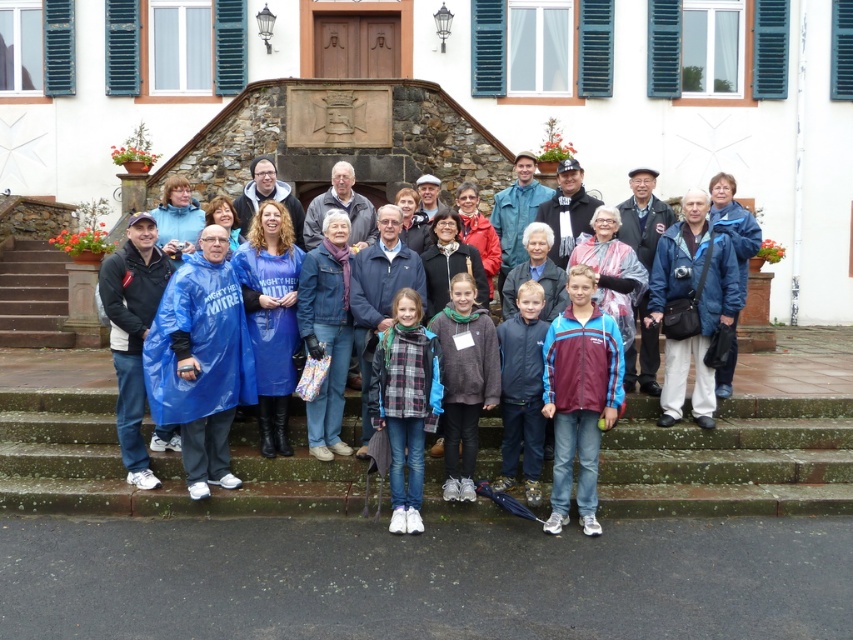
In the scene shown: Can you confirm if concrete stairs at center is positioned to the right of blue/white striped jacket at center?

Indeed, concrete stairs at center is positioned on the right side of blue/white striped jacket at center.

Is concrete stairs at center thinner than blue/white striped jacket at center?

Indeed, concrete stairs at center has a lesser width compared to blue/white striped jacket at center.

I want to click on concrete stairs at center, so click(x=730, y=460).

In order to click on concrete stairs at center in this screenshot , I will do `click(730, 460)`.

Who is positioned more to the right, concrete stairs at center or brown stone stairs at left?

concrete stairs at center

Which is above, concrete stairs at center or brown stone stairs at left?

brown stone stairs at left is above.

Which is in front, point (77, 502) or point (53, 264)?

Positioned in front is point (77, 502).

Where is `concrete stairs at center`? This screenshot has width=853, height=640. concrete stairs at center is located at coordinates (730, 460).

Who is more forward, (582, 268) or (537, 413)?

Point (582, 268)

Looking at this image, can you confirm if blue/white striped jacket at center is bigger than blue waterproof poncho at center?

Yes.

Is point (577, 493) positioned behind point (347, 467)?

No, it is in front of (347, 467).

Find the location of a particular element. blue/white striped jacket at center is located at coordinates (579, 396).